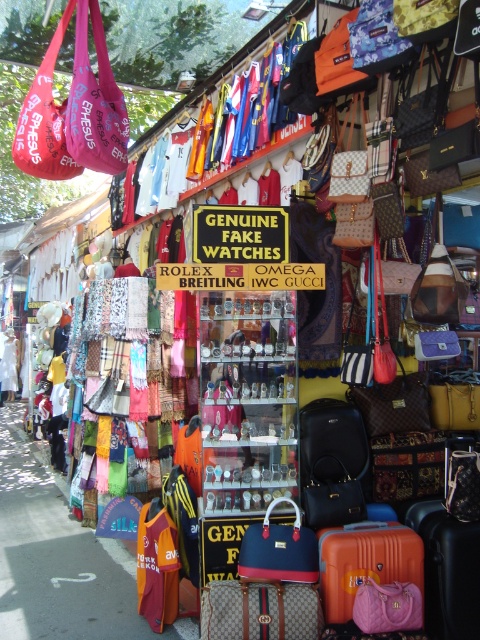
Question: Among these objects, which one is farthest from the camera?

Choices:
 (A) pink fabric bag at upper left
 (B) guccy fabric suitcase at center
 (C) white concrete pavement at lower left

Answer: (A)

Question: Among these points, which one is nearest to the camera?

Choices:
 (A) (355, 579)
 (B) (440, 627)

Answer: (B)

Question: Is pink fabric bag at upper left positioned at the back of guccy fabric suitcase at center?

Choices:
 (A) yes
 (B) no

Answer: (A)

Question: Is pink fabric bag at upper left to the right of orange matte suitcase at center from the viewer's perspective?

Choices:
 (A) no
 (B) yes

Answer: (A)

Question: Can you confirm if guccy fabric suitcase at center is positioned to the left of pink leather handbag at center?

Choices:
 (A) yes
 (B) no

Answer: (A)

Question: Which point appears closest to the camera in this image?

Choices:
 (A) pos(249,605)
 (B) pos(448,586)
 (C) pos(92,104)

Answer: (B)